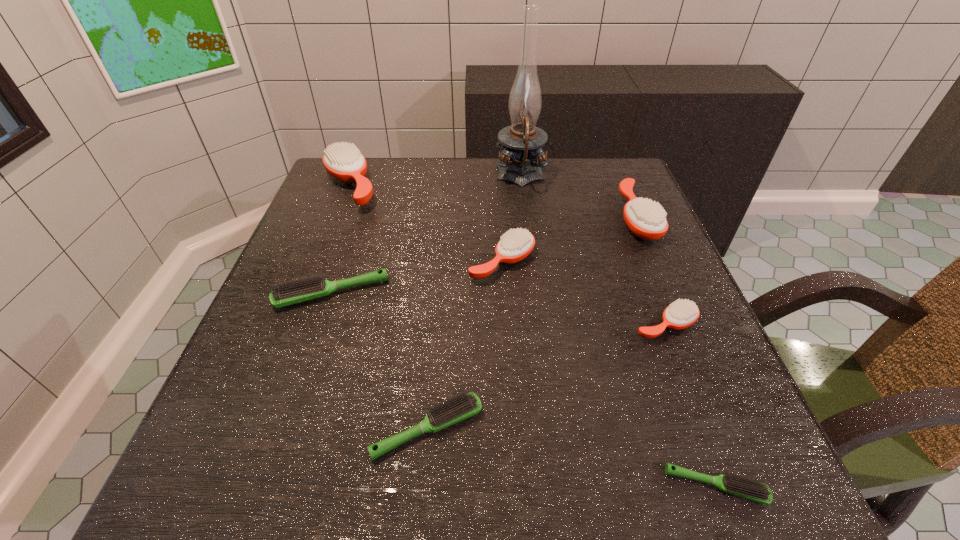
You are a GUI agent. You are given a task and a screenshot of the screen. Output one action in this format:
    pyautogui.click(x=<x>, y=<y>)
    Task: Click on the vacant position in the image that satisfies the following two spatial constraints: 1. on the front side of the smallest orange hairbrush; 2. on the left side of the farthest light hairbrush
    The height and width of the screenshot is (540, 960).
    Given the screenshot: What is the action you would take?
    pyautogui.click(x=322, y=325)

I want to click on free location that satisfies the following two spatial constraints: 1. on the front side of the smallest light hairbrush; 2. on the left side of the second nearest object, so click(422, 485).

Locate an element on the screen. This screenshot has height=540, width=960. vacant space that satisfies the following two spatial constraints: 1. on the front side of the nearest light hairbrush; 2. on the left side of the farthest light hairbrush is located at coordinates (268, 485).